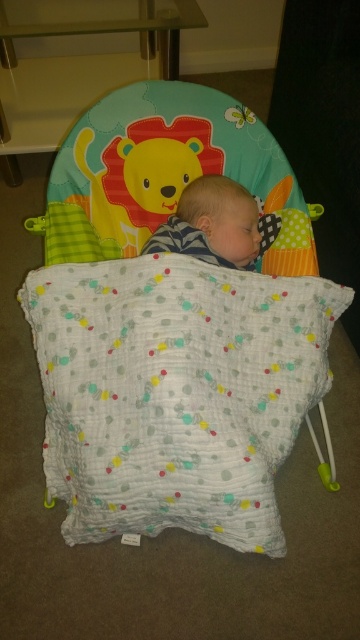
Question: Which of the following is the closest to the observer?

Choices:
 (A) soft white blanket at center
 (B) soft cotton baby bed at center

Answer: (B)

Question: Among these objects, which one is nearest to the camera?

Choices:
 (A) soft cotton baby bed at center
 (B) soft white blanket at center

Answer: (A)

Question: Does soft cotton baby bed at center appear over soft white blanket at center?

Choices:
 (A) yes
 (B) no

Answer: (B)

Question: Is soft cotton baby bed at center thinner than soft white blanket at center?

Choices:
 (A) no
 (B) yes

Answer: (A)

Question: Is soft cotton baby bed at center thinner than soft white blanket at center?

Choices:
 (A) yes
 (B) no

Answer: (B)

Question: Among these objects, which one is nearest to the camera?

Choices:
 (A) soft white blanket at center
 (B) soft cotton baby bed at center

Answer: (B)